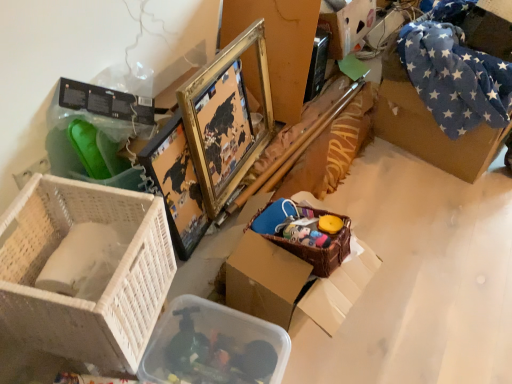
Question: From a real-world perspective, is cardboard box at upper right, the second storage box when ordered from bottom to top, located beneath gold metallic picture frame at upper center?

Choices:
 (A) no
 (B) yes

Answer: (A)

Question: Considering the relative sizes of cardboard box at upper right, positioned as the 1th storage box in back-to-front order, and gold metallic picture frame at upper center in the image provided, is cardboard box at upper right, positioned as the 1th storage box in back-to-front order, bigger than gold metallic picture frame at upper center?

Choices:
 (A) no
 (B) yes

Answer: (A)

Question: Is cardboard box at upper right, the second storage box when ordered from bottom to top, facing towards gold metallic picture frame at upper center?

Choices:
 (A) yes
 (B) no

Answer: (B)

Question: From a real-world perspective, does cardboard box at upper right, positioned as the 1th storage box in back-to-front order, stand above gold metallic picture frame at upper center?

Choices:
 (A) no
 (B) yes

Answer: (B)

Question: Considering the relative sizes of cardboard box at upper right, positioned as the 1th storage box in back-to-front order, and gold metallic picture frame at upper center in the image provided, is cardboard box at upper right, positioned as the 1th storage box in back-to-front order, smaller than gold metallic picture frame at upper center?

Choices:
 (A) no
 (B) yes

Answer: (B)

Question: Does cardboard box at upper right, the second storage box positioned from the left, have a greater height compared to gold metallic picture frame at upper center?

Choices:
 (A) yes
 (B) no

Answer: (B)

Question: From the image's perspective, is gold metallic picture frame at upper center located above cardboard box at upper right, which is the 1th storage box from top to bottom?

Choices:
 (A) no
 (B) yes

Answer: (A)

Question: Is gold metallic picture frame at upper center completely or partially outside of cardboard box at upper right, marked as the 1th storage box in a right-to-left arrangement?

Choices:
 (A) no
 (B) yes

Answer: (B)

Question: Considering the relative positions of gold metallic picture frame at upper center and cardboard box at upper right, which is counted as the second storage box, starting from the front, in the image provided, is gold metallic picture frame at upper center in front of cardboard box at upper right, which is counted as the second storage box, starting from the front,?

Choices:
 (A) no
 (B) yes

Answer: (B)

Question: From a real-world perspective, is gold metallic picture frame at upper center below cardboard box at upper right, the second storage box when ordered from bottom to top?

Choices:
 (A) yes
 (B) no

Answer: (A)

Question: Can you confirm if gold metallic picture frame at upper center is thinner than cardboard box at upper right, which is the 1th storage box from top to bottom?

Choices:
 (A) no
 (B) yes

Answer: (B)

Question: Considering the relative sizes of gold metallic picture frame at upper center and cardboard box at upper right, marked as the 1th storage box in a right-to-left arrangement, in the image provided, is gold metallic picture frame at upper center smaller than cardboard box at upper right, marked as the 1th storage box in a right-to-left arrangement,?

Choices:
 (A) no
 (B) yes

Answer: (A)

Question: Is white wicker basket at lower left inside gold metallic picture frame at upper center?

Choices:
 (A) yes
 (B) no

Answer: (B)